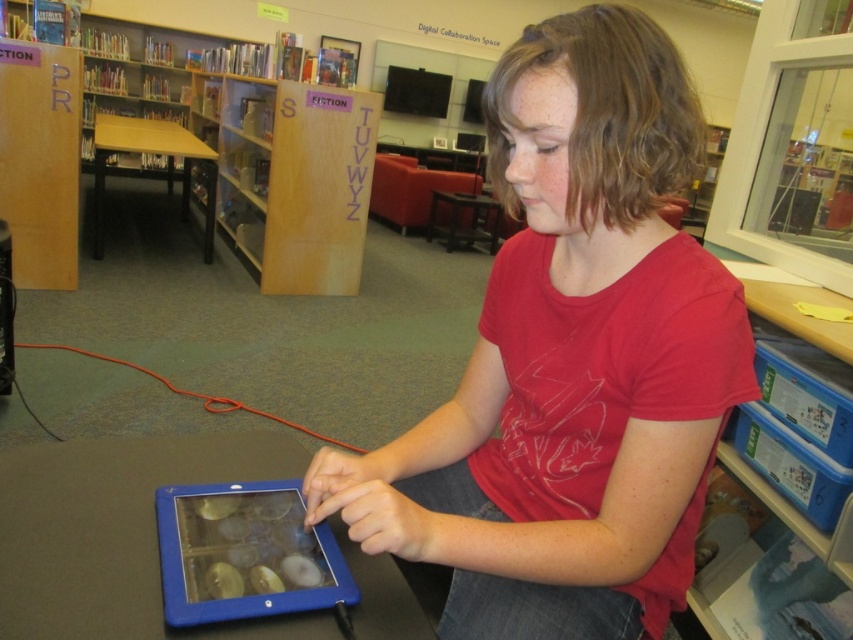
Is matte red shirt at center above blue rubberized tablet computer at center?

Indeed, matte red shirt at center is positioned over blue rubberized tablet computer at center.

Who is taller, matte red shirt at center or blue rubberized tablet computer at center?

With more height is matte red shirt at center.

Is point (598, 253) farther from camera compared to point (239, 600)?

Yes, point (598, 253) is farther from viewer.

Locate an element on the screen. The width and height of the screenshot is (853, 640). matte red shirt at center is located at coordinates (572, 360).